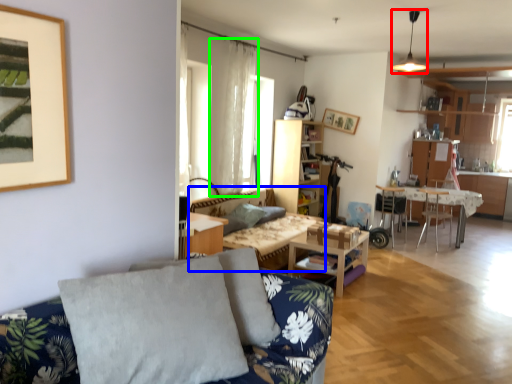
Question: Which object is positioned farthest from light fixture (highlighted by a red box)? Select from couch (highlighted by a blue box) and curtain (highlighted by a green box).

Choices:
 (A) couch
 (B) curtain

Answer: (A)